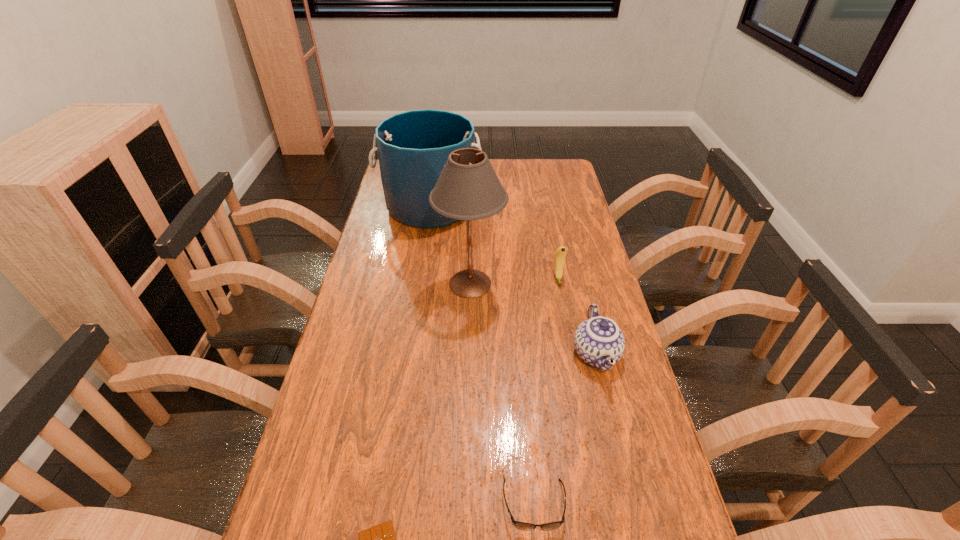
The image size is (960, 540). I want to click on vacant space that's between the sunglasses and the table lamp, so click(502, 394).

Identify the location of empty space that is in between the farthest object and the fourth farthest object. The image size is (960, 540). (514, 280).

Identify the location of free area in between the banana and the fifth shortest object. (494, 242).

Where is `free spot between the farthest object and the tallest object`? free spot between the farthest object and the tallest object is located at coordinates (450, 245).

Image resolution: width=960 pixels, height=540 pixels. I want to click on vacant space that is in between the chinaware and the second shortest object, so click(x=565, y=429).

Find the location of `free spot between the fourth farthest object and the sunglasses`. free spot between the fourth farthest object and the sunglasses is located at coordinates (565, 429).

The image size is (960, 540). Find the location of `free spot between the second shortest object and the bucket`. free spot between the second shortest object and the bucket is located at coordinates (482, 356).

At what (x,y) coordinates should I click in order to perform the action: click on free space between the banana and the second shortest object. Please return your answer as a coordinate pair (x, y). Looking at the image, I should click on (546, 392).

The width and height of the screenshot is (960, 540). In order to click on vacant area that lies between the bucket and the banana in this screenshot , I will do `click(494, 242)`.

In order to click on object that is the third nearest to the sunglasses in this screenshot , I will do [x=468, y=188].